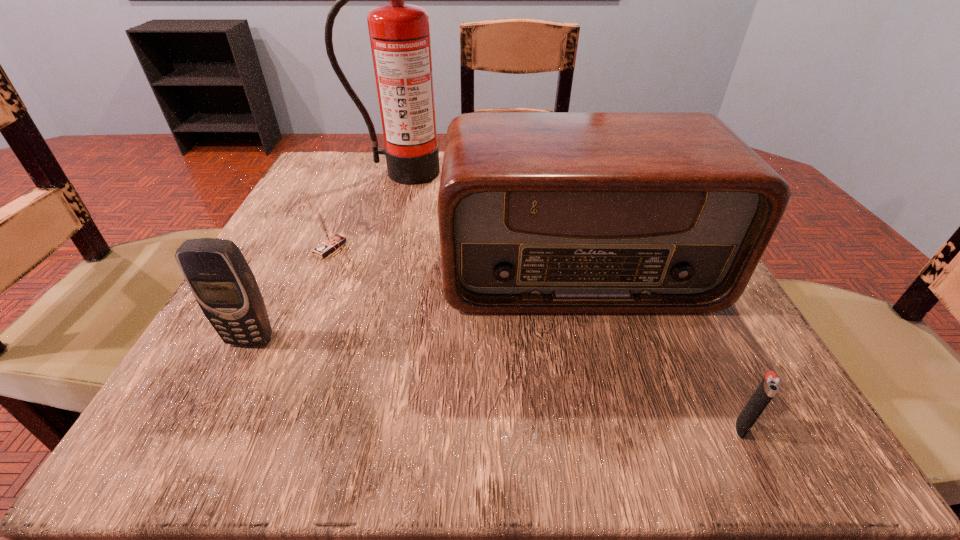
Find the location of a particular element. The width and height of the screenshot is (960, 540). unoccupied position between the radio receiver and the third shortest object is located at coordinates (414, 305).

Locate which object ranks second in proximity to the tallest object. Please provide its 2D coordinates. Your answer should be formatted as a tuple, i.e. [(x, y)], where the tuple contains the x and y coordinates of a point satisfying the conditions above.

[(330, 242)]

At what (x,y) coordinates should I click in order to perform the action: click on object that is the fourth nearest to the fourth shortest object. Please return your answer as a coordinate pair (x, y). The image size is (960, 540). Looking at the image, I should click on (219, 277).

The width and height of the screenshot is (960, 540). Identify the location of vacant position in the image that satisfies the following two spatial constraints: 1. on the front face of the igniter; 2. on the left side of the third tallest object. (205, 427).

The image size is (960, 540). Identify the location of vacant space that satisfies the following two spatial constraints: 1. on the front face of the cellular telephone; 2. on the left side of the nearest object. pos(205,427).

At what (x,y) coordinates should I click in order to perform the action: click on free space that satisfies the following two spatial constraints: 1. on the front panel of the nearest object; 2. on the right side of the radio receiver. Please return your answer as a coordinate pair (x, y). This screenshot has height=540, width=960. Looking at the image, I should click on (618, 427).

You are a GUI agent. You are given a task and a screenshot of the screen. Output one action in this format:
    pyautogui.click(x=<x>, y=<y>)
    Task: Click on the free space in the image that satisfies the following two spatial constraints: 1. on the front panel of the nearest object; 2. on the right side of the second tallest object
    This screenshot has width=960, height=540.
    Given the screenshot: What is the action you would take?
    pyautogui.click(x=618, y=427)